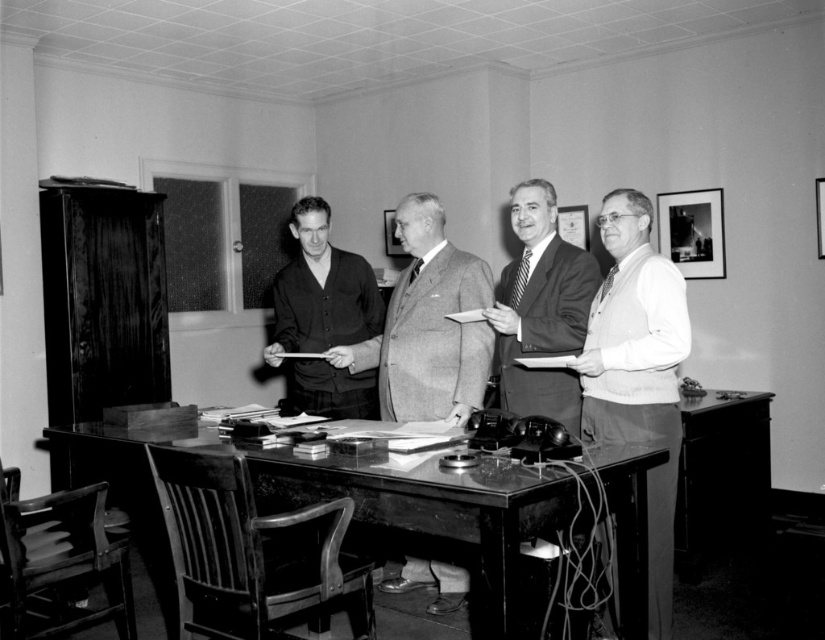
Question: Which object is the farthest from the white textured vest at right?

Choices:
 (A) smooth gray suit at center
 (B) smooth dark suit at center
 (C) wooden desk at center
 (D) dark gray cardigan at center

Answer: (D)

Question: Does white textured vest at right have a greater width compared to smooth gray suit at center?

Choices:
 (A) no
 (B) yes

Answer: (A)

Question: From the image, what is the correct spatial relationship of white textured vest at right in relation to dark gray cardigan at center?

Choices:
 (A) above
 (B) below

Answer: (B)

Question: Among these points, which one is farthest from the camera?

Choices:
 (A) (609, 246)
 (B) (522, 317)
 (C) (396, 406)

Answer: (C)

Question: Estimate the real-world distances between objects in this image. Which object is closer to the smooth gray suit at center?

Choices:
 (A) dark gray cardigan at center
 (B) white textured vest at right

Answer: (A)

Question: Is the position of smooth gray suit at center less distant than that of dark gray cardigan at center?

Choices:
 (A) no
 (B) yes

Answer: (B)